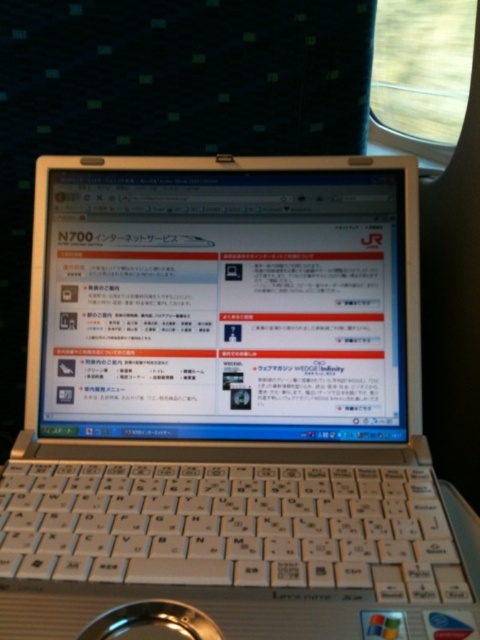
You are sitting on a train seat and want to reach the point at coordinates point (96, 422). Your hand can extend 60 centimeters. Can you reach it?

The distance between you and the point (96, 422) is 58.22 centimeters, so yes, you can reach it since your hand can extend 60 centimeters.

You are sitting on a train seat and see two points on the laptop screen. The first point is at coordinate point (x=189, y=534) and the second is at point (x=156, y=616). From your perspective, which point is closer to you?

Point (x=156, y=616) is closer to you because it is in front of point (x=189, y=534).

You are a photographer taking a photo of the laptop screen. There are two points on the screen at coordinates point (180, 168) and point (421, 596). Which point is closer to the camera?

Point (180, 168) is further to the camera than point (421, 596), so the closer point to the camera is point (421, 596).